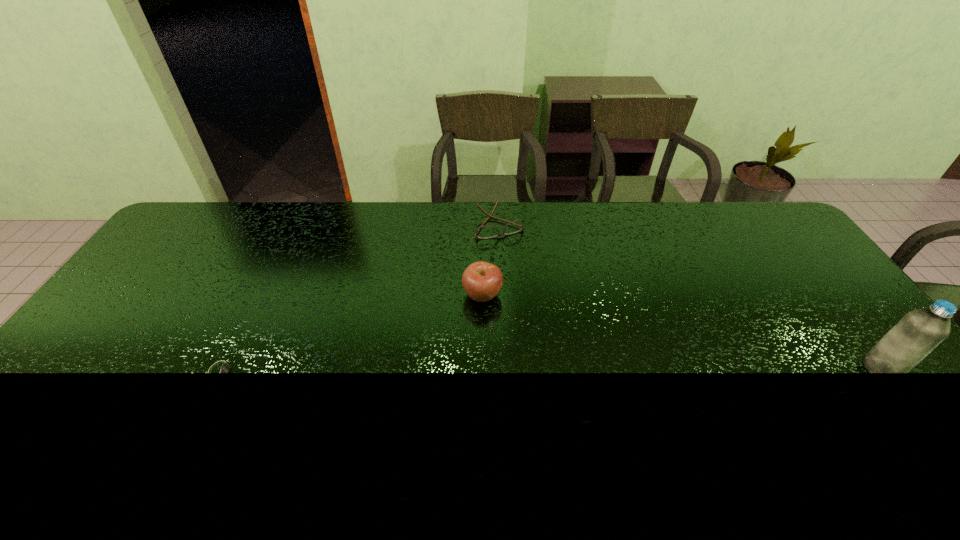
Where is `free space on the desktop that is between the watch and the tallest object and is positioned on the side of the third shortest object with the unique marking`? free space on the desktop that is between the watch and the tallest object and is positioned on the side of the third shortest object with the unique marking is located at coordinates 564,370.

Where is `free spot on the desktop that is between the leftmost object and the water bottle and is positioned on the front-facing side of the farthest object`? This screenshot has height=540, width=960. free spot on the desktop that is between the leftmost object and the water bottle and is positioned on the front-facing side of the farthest object is located at coordinates (574, 370).